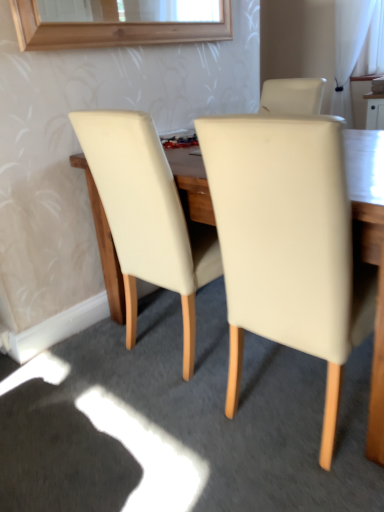
Question: In terms of height, does beige leather chair at center, which is counted as the 1th chair, starting from the left, look taller or shorter compared to beige leather chair at center, marked as the second chair in a left-to-right arrangement?

Choices:
 (A) tall
 (B) short

Answer: (B)

Question: From a real-world perspective, is beige leather chair at center, which is counted as the 1th chair, starting from the left, physically located above or below beige leather chair at center, marked as the second chair in a left-to-right arrangement?

Choices:
 (A) above
 (B) below

Answer: (A)

Question: Which object is positioned farthest from the beige leather chair at center, arranged as the 2th chair when viewed from the right?

Choices:
 (A) white sheer curtain at upper right
 (B) beige leather chair at center, marked as the second chair in a left-to-right arrangement

Answer: (A)

Question: Which object is the farthest from the white sheer curtain at upper right?

Choices:
 (A) beige leather chair at center, arranged as the 2th chair when viewed from the right
 (B) beige leather chair at center, marked as the second chair in a left-to-right arrangement

Answer: (B)